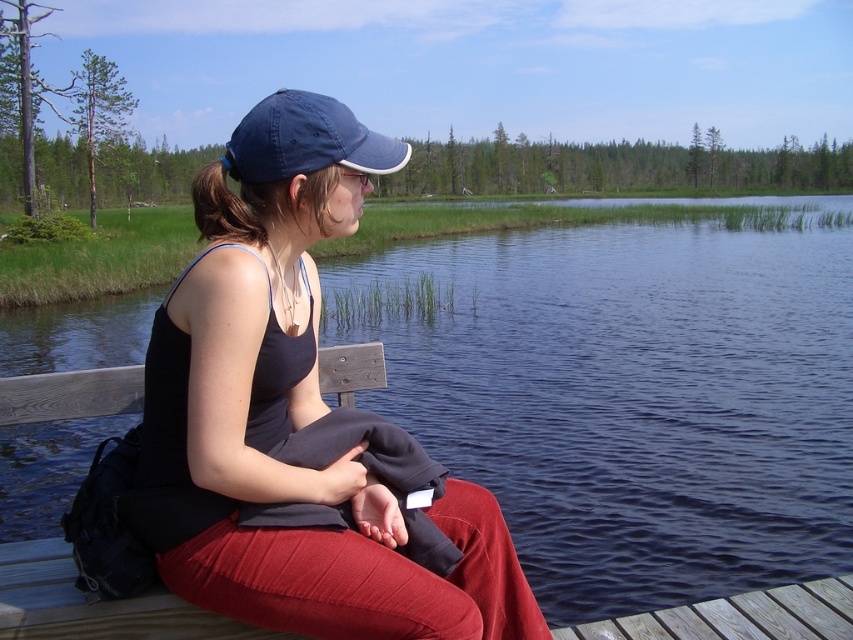
Is blue water at center positioned in front of matte black tank top at center?

No, blue water at center is further to the viewer.

Based on the photo, can you confirm if blue water at center is positioned to the left of matte black tank top at center?

No, blue water at center is not to the left of matte black tank top at center.

Does point (136, 344) come in front of point (180, 564)?

No, it is behind (180, 564).

The height and width of the screenshot is (640, 853). In order to click on blue water at center in this screenshot , I will do `click(631, 396)`.

Can you confirm if matte black tank top at center is smaller than navy blue fabric cap at upper center?

Yes, matte black tank top at center is smaller than navy blue fabric cap at upper center.

Is matte black tank top at center positioned before navy blue fabric cap at upper center?

Yes, matte black tank top at center is in front of navy blue fabric cap at upper center.

The height and width of the screenshot is (640, 853). In order to click on matte black tank top at center in this screenshot , I will do `click(293, 412)`.

Locate an element on the screen. matte black tank top at center is located at coordinates (293, 412).

Is the position of blue water at center less distant than that of navy blue fabric cap at upper center?

No, blue water at center is behind navy blue fabric cap at upper center.

This screenshot has height=640, width=853. Find the location of `blue water at center`. blue water at center is located at coordinates (631, 396).

Where is `blue water at center`? This screenshot has width=853, height=640. blue water at center is located at coordinates (631, 396).